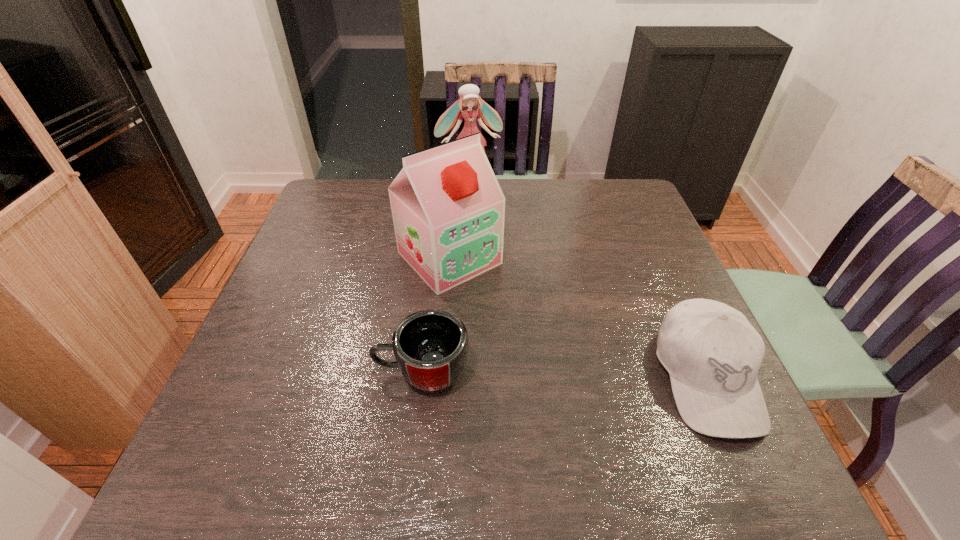
Point out which object is positioned as the third nearest to the doll. Please provide its 2D coordinates. Your answer should be formatted as a tuple, i.e. [(x, y)], where the tuple contains the x and y coordinates of a point satisfying the conditions above.

[(712, 353)]

This screenshot has height=540, width=960. I want to click on the closest object to the rightmost object, so click(448, 209).